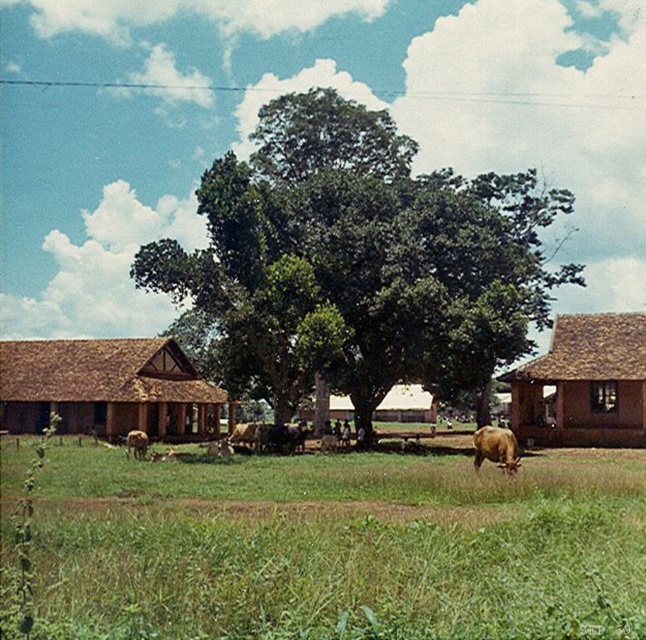
You are a farmer who wants to build a fence around your property. You have a limited amount of fencing material. Which object, the brown thatched roof hut at left or the brown textured cow at center, would require more fencing material to enclose it based on their size?

The brown thatched roof hut at left is larger in size than the brown textured cow at center, so enclosing the brown thatched roof hut at left would require more fencing material.